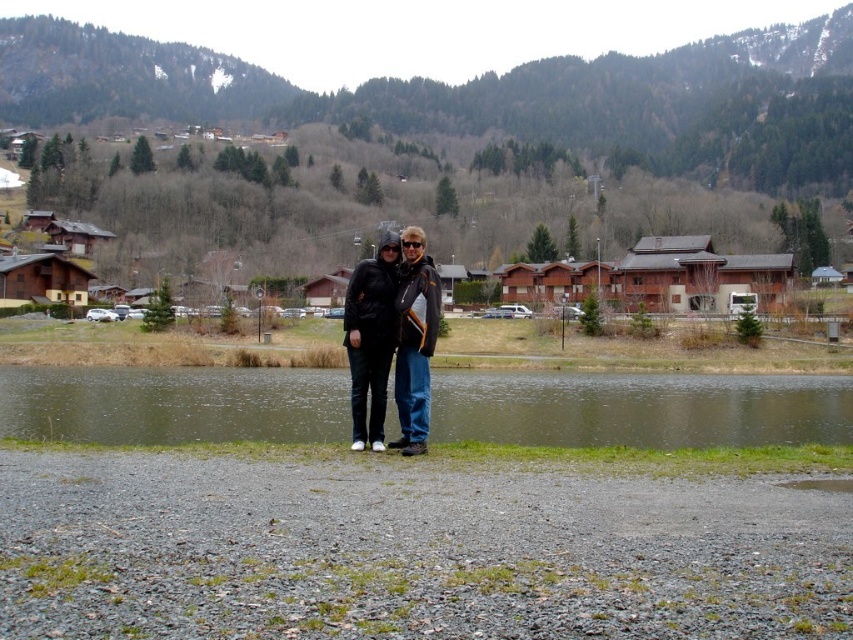
Is greenish water at center shorter than matte black jackets at center?

Yes.

Who is shorter, greenish water at center or matte black jackets at center?

greenish water at center is shorter.

Is point (844, 440) farther from viewer compared to point (415, 300)?

Yes.

Locate an element on the screen. This screenshot has width=853, height=640. greenish water at center is located at coordinates (640, 408).